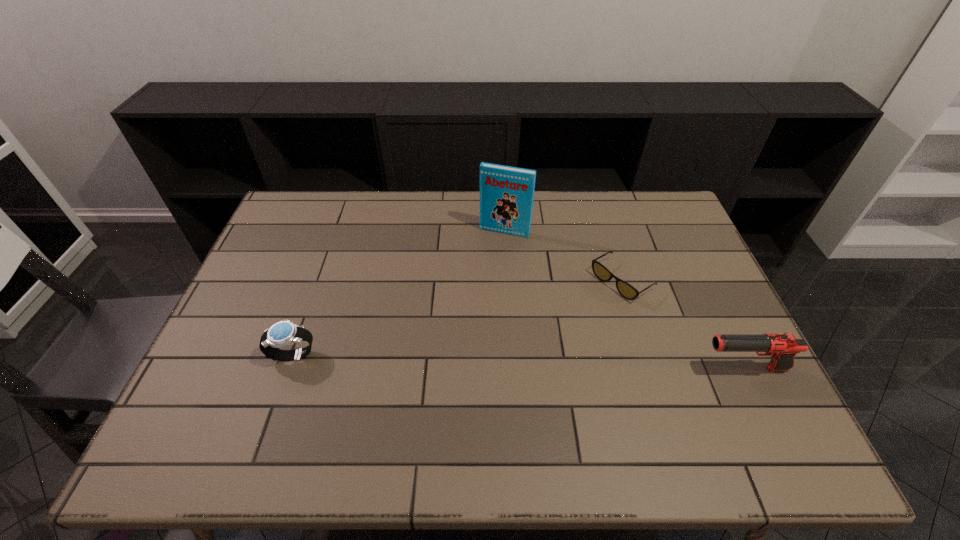
Identify the location of object located in the right edge section of the desktop. (782, 348).

Locate an element on the screen. This screenshot has width=960, height=540. vacant area at the far edge is located at coordinates (326, 230).

Find the location of `vacant space at the near edge of the desktop`. vacant space at the near edge of the desktop is located at coordinates 471,394.

In the image, there is a desktop. At what (x,y) coordinates should I click in order to perform the action: click on vacant space at the left edge. Please return your answer as a coordinate pair (x, y). The height and width of the screenshot is (540, 960). Looking at the image, I should click on (211, 366).

In the image, there is a desktop. Identify the location of vacant space at the right edge. (669, 280).

Where is `vacant space at the far left corner of the desktop`? Image resolution: width=960 pixels, height=540 pixels. vacant space at the far left corner of the desktop is located at coordinates pos(299,212).

You are a GUI agent. You are given a task and a screenshot of the screen. Output one action in this format:
    pyautogui.click(x=<x>, y=<y>)
    Task: Click on the vacant space at the far right corner of the desktop
    
    Given the screenshot: What is the action you would take?
    pyautogui.click(x=641, y=228)

You are a GUI agent. You are given a task and a screenshot of the screen. Output one action in this format:
    pyautogui.click(x=<x>, y=<y>)
    Task: Click on the empty space between the gun and the leftmost object
    This screenshot has width=960, height=540.
    Given the screenshot: What is the action you would take?
    pyautogui.click(x=518, y=361)

Identify the location of vacant area between the sunglasses and the farthest object. (564, 256).

In order to click on free spot between the gun and the third nearest object in this screenshot , I will do `click(683, 325)`.